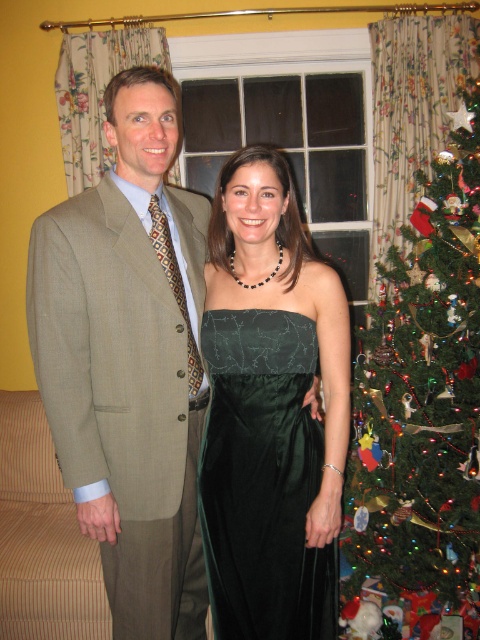
Question: Among these points, which one is farthest from the camera?

Choices:
 (A) (154, 260)
 (B) (420, 497)

Answer: (B)

Question: From the image, what is the correct spatial relationship of velvet green dress at center in relation to satin dark green dress at center?

Choices:
 (A) below
 (B) above

Answer: (B)

Question: Can you confirm if velvet green dress at center is thinner than satin dark green dress at center?

Choices:
 (A) no
 (B) yes

Answer: (A)

Question: Which object is the farthest from the velvet green dress at center?

Choices:
 (A) satin dark green dress at center
 (B) green velvet christmas tree at right

Answer: (B)

Question: Is the position of velvet green dress at center more distant than that of green velvet christmas tree at right?

Choices:
 (A) yes
 (B) no

Answer: (B)

Question: Which object is closer to the camera taking this photo?

Choices:
 (A) velvet green dress at center
 (B) green velvet christmas tree at right
 (C) satin dark green dress at center

Answer: (A)